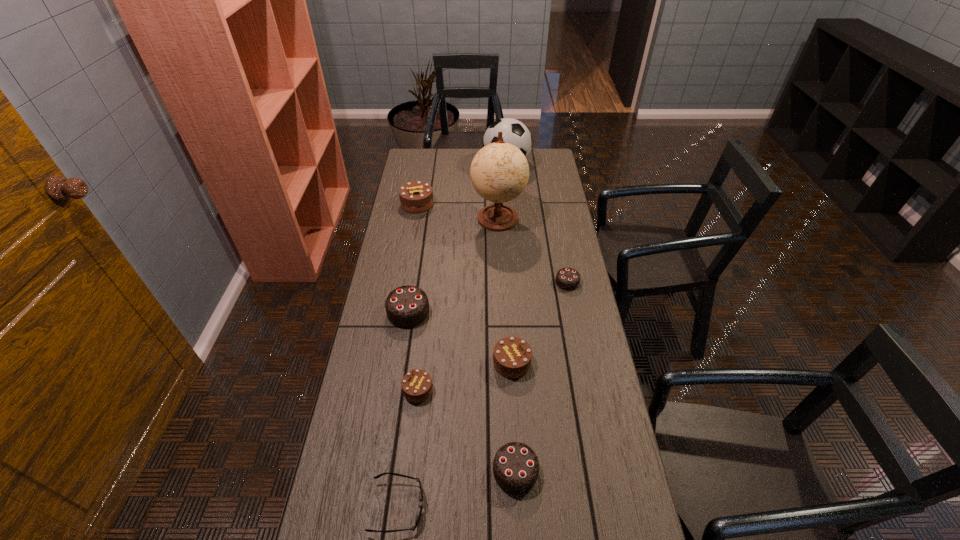
The width and height of the screenshot is (960, 540). Identify the location of chocolate chocolate cake object that ranks as the closest to the second smallest brown chocolate cake. (515, 467).

Find the location of a particular element. The image size is (960, 540). chocolate chocolate cake that stands as the closest to the eighth shortest object is located at coordinates (568, 279).

Locate an element on the screen. vacant position in the image that satisfies the following two spatial constraints: 1. on the front side of the nearest chocolate cake; 2. on the right side of the biggest brown chocolate cake is located at coordinates (372, 471).

I want to click on free point that satisfies the following two spatial constraints: 1. on the front side of the nearest chocolate cake; 2. on the right side of the fifth nearest object, so click(x=385, y=471).

Where is `free space that satisfies the following two spatial constraints: 1. on the back side of the farthest chocolate cake; 2. on the right side of the black soccer ball`? free space that satisfies the following two spatial constraints: 1. on the back side of the farthest chocolate cake; 2. on the right side of the black soccer ball is located at coordinates (423, 166).

I want to click on free region that satisfies the following two spatial constraints: 1. on the back side of the second tallest object; 2. on the right side of the second chocolate chocolate cake from left to right, so click(498, 166).

This screenshot has height=540, width=960. In order to click on vacant space that satisfies the following two spatial constraints: 1. on the front side of the biggest brown chocolate cake; 2. on the left side of the rightmost chocolate cake in this screenshot , I will do `click(404, 282)`.

At what (x,y) coordinates should I click in order to perform the action: click on vacant area in the image that satisfies the following two spatial constraints: 1. on the front side of the biggest brown chocolate cake; 2. on the left side of the fourth farthest object. Please return your answer as a coordinate pair (x, y). Looking at the image, I should click on (404, 282).